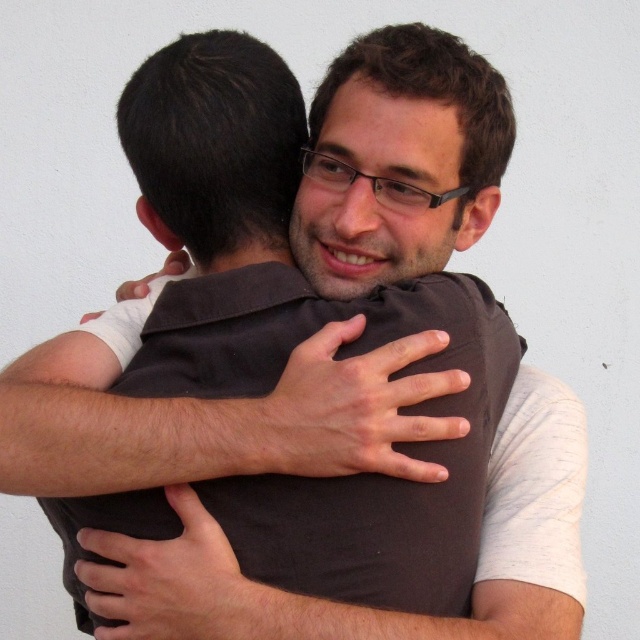
Question: From the image, what is the correct spatial relationship of brown fabric arm at center in relation to dark brown fabric at center?

Choices:
 (A) left
 (B) right

Answer: (A)

Question: Can you confirm if brown fabric arm at center is positioned above dark brown fabric at center?

Choices:
 (A) yes
 (B) no

Answer: (A)

Question: Does brown fabric arm at center appear on the left side of dark brown fabric at center?

Choices:
 (A) no
 (B) yes

Answer: (B)

Question: Among these objects, which one is nearest to the camera?

Choices:
 (A) dark brown fabric at center
 (B) brown fabric arm at center

Answer: (B)